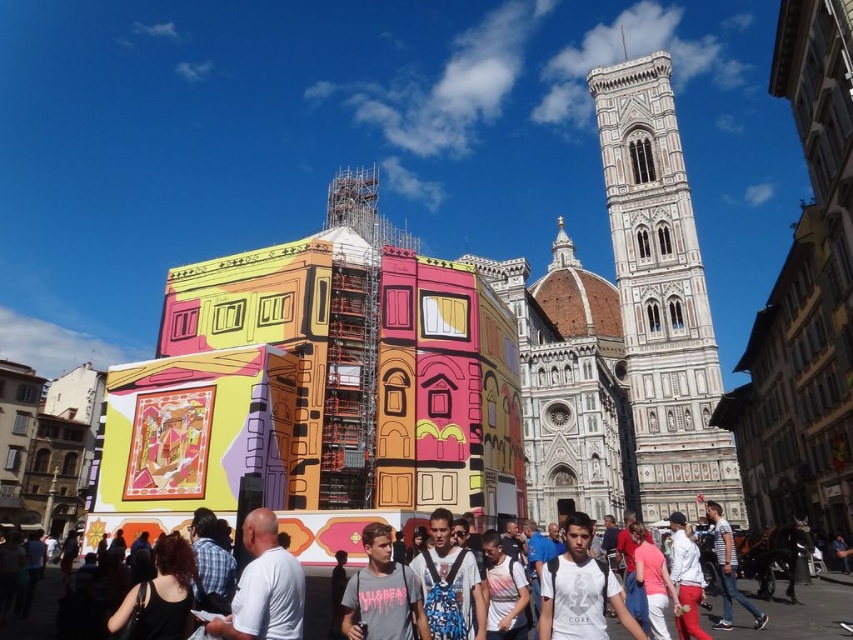
Is white matte shirt at center to the left of pink cotton shirt at center from the viewer's perspective?

No, white matte shirt at center is not to the left of pink cotton shirt at center.

Which is behind, point (686, 544) or point (650, 612)?

The point (686, 544) is more distant.

Identify the location of white matte shirt at center. The image size is (853, 640). (685, 579).

How distant is dark brown hair at lower left from white matte shirt at center?

dark brown hair at lower left and white matte shirt at center are 32.19 meters apart.

Who is shorter, dark brown hair at lower left or white matte shirt at center?

dark brown hair at lower left

At what (x,y) coordinates should I click in order to perform the action: click on dark brown hair at lower left. Please return your answer as a coordinate pair (x, y). The height and width of the screenshot is (640, 853). Looking at the image, I should click on (160, 596).

Between dark brown hair at lower left and pink cotton shirt at center, which one has more height?

Standing taller between the two is dark brown hair at lower left.

At what (x,y) coordinates should I click in order to perform the action: click on dark brown hair at lower left. Please return your answer as a coordinate pair (x, y). Image resolution: width=853 pixels, height=640 pixels. Looking at the image, I should click on (160, 596).

The height and width of the screenshot is (640, 853). I want to click on dark brown hair at lower left, so click(160, 596).